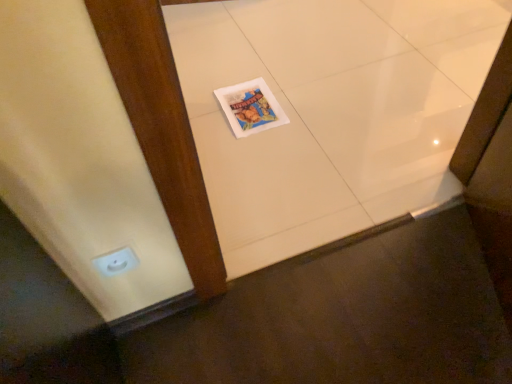
Where is `matte paper magazine at center`? matte paper magazine at center is located at coordinates (250, 107).

Measure the distance between white glossy electric outlet at lower left and camera.

white glossy electric outlet at lower left is 34.29 inches from camera.

The width and height of the screenshot is (512, 384). Find the location of `matte paper magazine at center`. matte paper magazine at center is located at coordinates (250, 107).

Can you confirm if white glossy electric outlet at lower left is smaller than white glossy tile at center?

Correct, white glossy electric outlet at lower left occupies less space than white glossy tile at center.

Choose the correct answer: Is white glossy electric outlet at lower left inside white glossy tile at center or outside it?

white glossy electric outlet at lower left lies outside white glossy tile at center.

From the image's perspective, between white glossy electric outlet at lower left and white glossy tile at center, which one is located above?

white glossy tile at center.

From the image's perspective, does matte paper magazine at center appear higher than white glossy electric outlet at lower left?

Yes, from the image's perspective, matte paper magazine at center is above white glossy electric outlet at lower left.

Identify the location of electric outlet above the matte paper magazine at center (from a real-world perspective). The height and width of the screenshot is (384, 512). (116, 262).

Which of these two, matte paper magazine at center or white glossy electric outlet at lower left, is wider?

With larger width is matte paper magazine at center.

From a real-world perspective, is matte paper magazine at center beneath white glossy electric outlet at lower left?

Yes, from a real-world perspective, matte paper magazine at center is beneath white glossy electric outlet at lower left.

From a real-world perspective, is white glossy tile at center below matte paper magazine at center?

Yes.

Is white glossy tile at center inside the boundaries of matte paper magazine at center, or outside?

The correct answer is: outside.

Considering the sizes of white glossy tile at center and matte paper magazine at center in the image, is white glossy tile at center taller or shorter than matte paper magazine at center?

Considering their sizes, white glossy tile at center has more height than matte paper magazine at center.

Is white glossy tile at center facing towards matte paper magazine at center?

Yes, white glossy tile at center is aimed at matte paper magazine at center.

Between matte paper magazine at center and white glossy tile at center, which one has smaller size?

matte paper magazine at center is smaller.

Looking at this image, considering the positions of objects matte paper magazine at center and white glossy tile at center in the image provided, who is in front, matte paper magazine at center or white glossy tile at center?

white glossy tile at center is in front.

Looking at this image, is matte paper magazine at center aimed at white glossy tile at center?

Yes.

Considering the sizes of objects white glossy tile at center and white glossy electric outlet at lower left in the image provided, who is smaller, white glossy tile at center or white glossy electric outlet at lower left?

white glossy electric outlet at lower left is smaller.

Is white glossy tile at center aimed at white glossy electric outlet at lower left?

No, white glossy tile at center is not oriented towards white glossy electric outlet at lower left.

From their relative heights in the image, would you say white glossy tile at center is taller or shorter than white glossy electric outlet at lower left?

In the image, white glossy tile at center appears to be shorter than white glossy electric outlet at lower left.

Relative to white glossy electric outlet at lower left, is white glossy tile at center in front or behind?

white glossy tile at center is positioned farther from the viewer than white glossy electric outlet at lower left.

In order to click on electric outlet on the left side of matte paper magazine at center in this screenshot , I will do `click(116, 262)`.

Would you say white glossy electric outlet at lower left contains matte paper magazine at center?

Definitely not — matte paper magazine at center is not inside white glossy electric outlet at lower left.

From a real-world perspective, is white glossy electric outlet at lower left positioned over matte paper magazine at center based on gravity?

Yes, from a real-world perspective, white glossy electric outlet at lower left is on top of matte paper magazine at center.

How distant is white glossy electric outlet at lower left from matte paper magazine at center?

white glossy electric outlet at lower left is 84.23 centimeters away from matte paper magazine at center.

In the image, there is a white glossy electric outlet at lower left. Identify the location of ceramic tile below it (from a real-world perspective). Image resolution: width=512 pixels, height=384 pixels. (330, 112).

Locate an element on the screen. This screenshot has width=512, height=384. electric outlet that appears above the matte paper magazine at center (from a real-world perspective) is located at coordinates (116, 262).

When comparing their distances from white glossy tile at center, does matte paper magazine at center or white glossy electric outlet at lower left seem further?

Based on the image, white glossy electric outlet at lower left appears to be further to white glossy tile at center.

Estimate the real-world distances between objects in this image. Which object is further from matte paper magazine at center, white glossy electric outlet at lower left or white glossy tile at center?

white glossy electric outlet at lower left.

Estimate the real-world distances between objects in this image. Which object is further from matte paper magazine at center, white glossy tile at center or white glossy electric outlet at lower left?

white glossy electric outlet at lower left is positioned further to the anchor matte paper magazine at center.

In the scene shown: Based on their spatial positions, is white glossy tile at center or matte paper magazine at center further from white glossy electric outlet at lower left?

The object further to white glossy electric outlet at lower left is white glossy tile at center.

Estimate the real-world distances between objects in this image. Which object is further from white glossy electric outlet at lower left, matte paper magazine at center or white glossy tile at center?

white glossy tile at center is further to white glossy electric outlet at lower left.

Estimate the real-world distances between objects in this image. Which object is closer to white glossy tile at center, white glossy electric outlet at lower left or matte paper magazine at center?

The object closer to white glossy tile at center is matte paper magazine at center.

Locate an element on the screen. ceramic tile located between white glossy electric outlet at lower left and matte paper magazine at center in the depth direction is located at coordinates (330, 112).